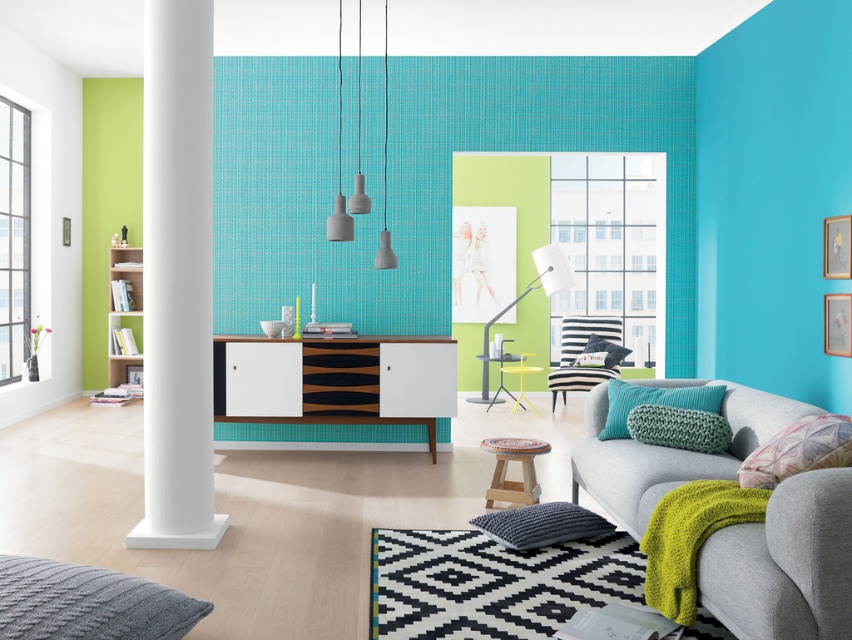
Question: Is pastel pink fabric pillow at lower right thinner than teal knitted pillow at lower right?

Choices:
 (A) yes
 (B) no

Answer: (A)

Question: Is teal knitted pillow at lower right in front of textured black pillow at center?

Choices:
 (A) yes
 (B) no

Answer: (A)

Question: Is green knitted pillow at lower right above teal knitted pillow at lower right?

Choices:
 (A) yes
 (B) no

Answer: (B)

Question: Which object is farther from the camera taking this photo?

Choices:
 (A) pastel pink fabric pillow at lower right
 (B) green knitted pillow at lower right
 (C) white smooth column at left

Answer: (C)

Question: Which point is closer to the camera?

Choices:
 (A) (721, 400)
 (B) (847, 637)
 (C) (810, 428)
 (D) (602, 353)

Answer: (B)

Question: Which object appears farthest from the camera in this image?

Choices:
 (A) striped fabric armchair at center
 (B) textured black pillow at center

Answer: (B)